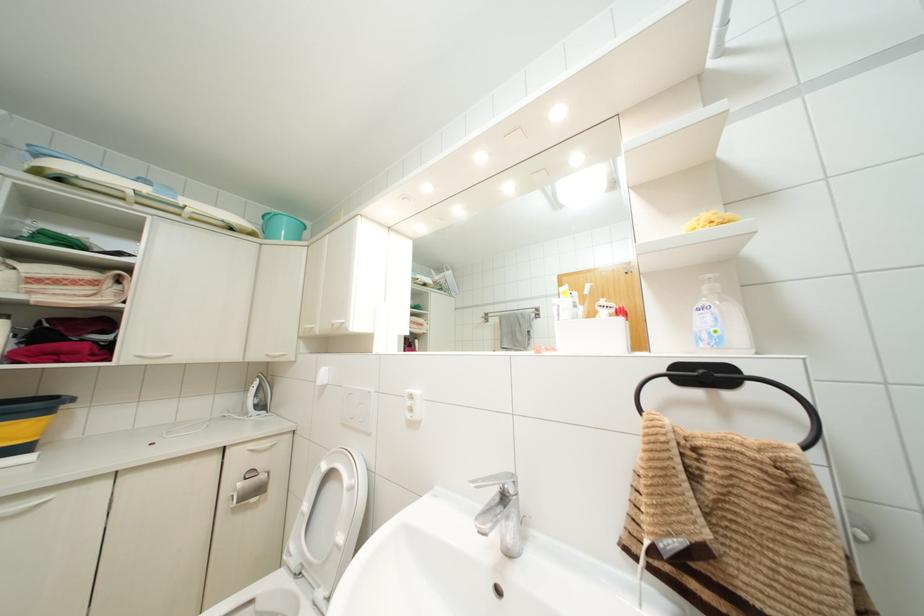
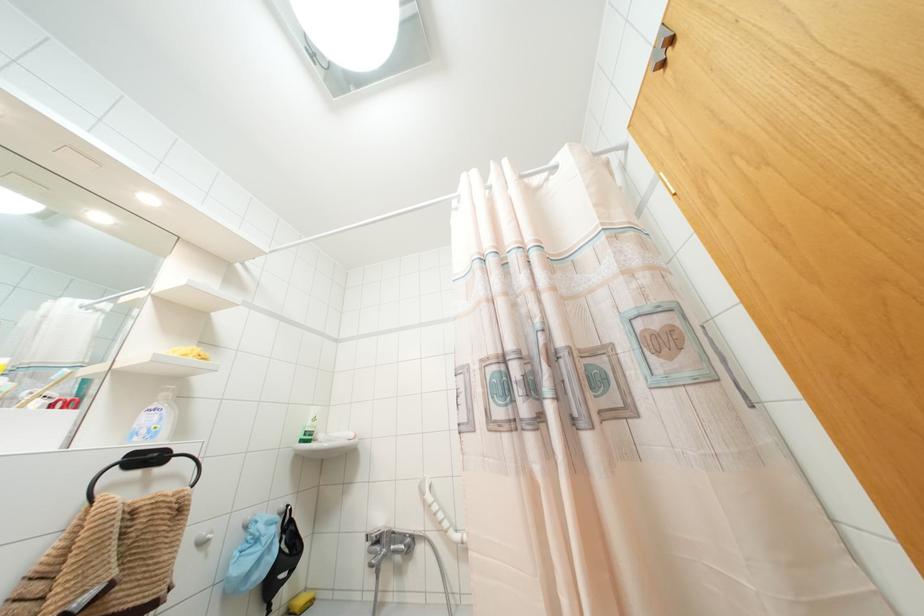
How did the camera likely rotate?

The camera rotated toward right-up.